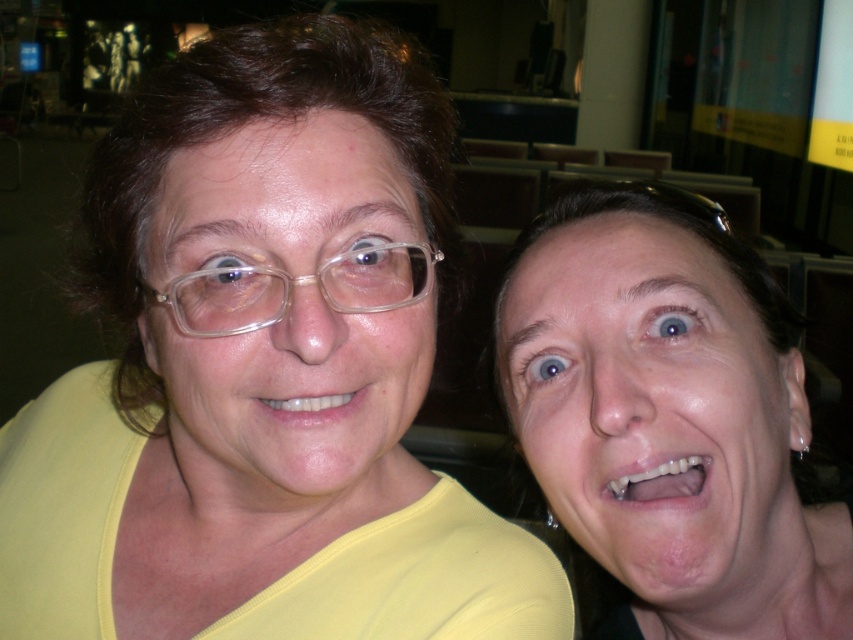
Question: Is yellow matte shirt at upper left below matte yellow shirt at center?

Choices:
 (A) yes
 (B) no

Answer: (A)

Question: Among these points, which one is farthest from the camera?

Choices:
 (A) (173, 216)
 (B) (407, 499)
 (C) (618, 406)
 (D) (316, 406)

Answer: (B)

Question: Can you confirm if matte yellow shirt at center is positioned to the right of matte white teeth at center?

Choices:
 (A) yes
 (B) no

Answer: (B)

Question: Among these objects, which one is nearest to the camera?

Choices:
 (A) yellow matte shirt at upper left
 (B) matte yellow shirt at center
 (C) white glossy teeth at lower center
 (D) transparent plastic glasses at upper left

Answer: (A)

Question: Observing the image, what is the correct spatial positioning of yellow matte shirt at upper left in reference to transparent plastic glasses at upper left?

Choices:
 (A) right
 (B) left

Answer: (B)

Question: Which point is farther from the camera taking this photo?

Choices:
 (A) (415, 250)
 (B) (643, 472)
 (C) (294, 224)
 (D) (294, 404)

Answer: (A)